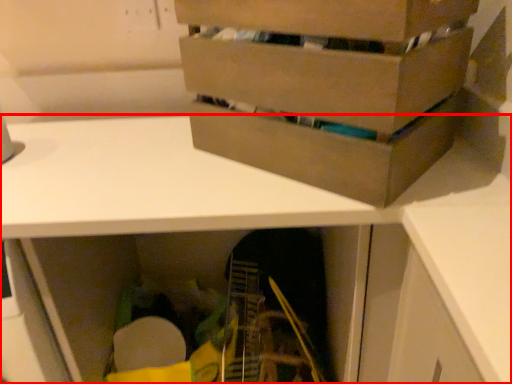
Question: From the image's perspective, what is the correct spatial positioning of desk (annotated by the red box) in reference to box?

Choices:
 (A) above
 (B) below

Answer: (B)